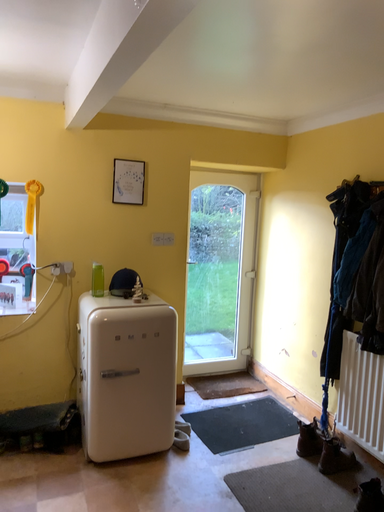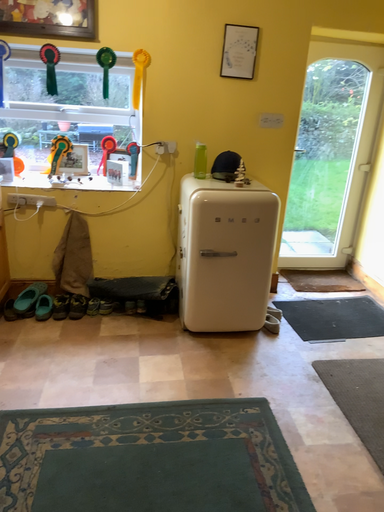
Question: Which way did the camera rotate in the video?

Choices:
 (A) rotated upward
 (B) rotated downward

Answer: (B)